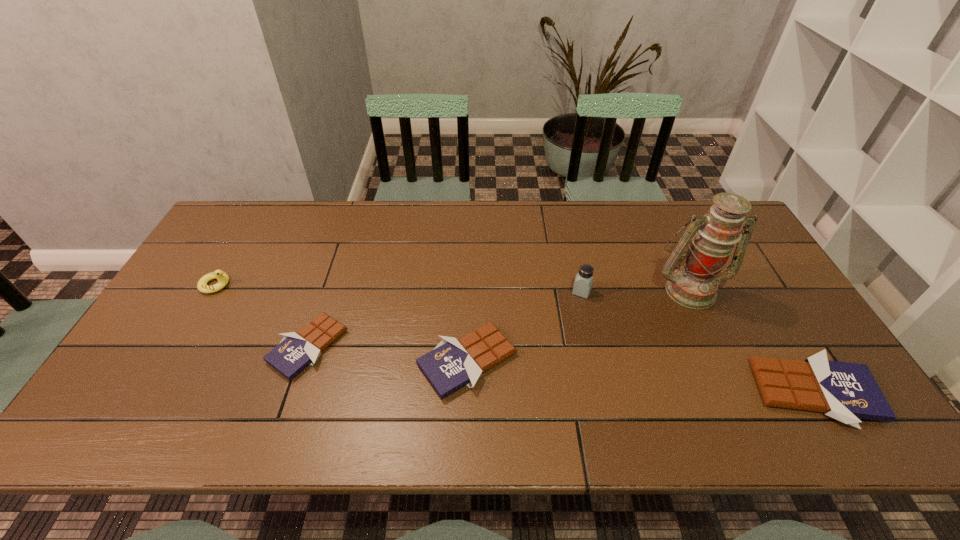
You are a GUI agent. You are given a task and a screenshot of the screen. Output one action in this format:
    pyautogui.click(x=<x>, y=<y>)
    Task: Click on the shortest object
    
    Given the screenshot: What is the action you would take?
    pyautogui.click(x=295, y=352)

You are a GUI agent. You are given a task and a screenshot of the screen. Output one action in this format:
    pyautogui.click(x=<x>, y=<y>)
    Task: Click on the shortest chocolate bar
    The image size is (960, 540).
    Given the screenshot: What is the action you would take?
    pyautogui.click(x=295, y=352)

Identify the location of the fifth tallest object. (452, 364).

Find the location of a particular element. The image size is (960, 540). the fourth object from right to left is located at coordinates (452, 364).

Locate an element on the screen. the rightmost chocolate bar is located at coordinates (845, 391).

Locate an element on the screen. The image size is (960, 540). the fourth shortest object is located at coordinates click(x=223, y=279).

This screenshot has width=960, height=540. Find the location of `the leftmost object`. the leftmost object is located at coordinates (223, 279).

Locate an element on the screen. This screenshot has width=960, height=540. the tallest object is located at coordinates (694, 285).

This screenshot has height=540, width=960. Find the location of `the fifth shortest object`. the fifth shortest object is located at coordinates click(x=584, y=278).

Locate an element on the screen. Image resolution: width=960 pixels, height=540 pixels. the fourth object from left to right is located at coordinates (584, 278).